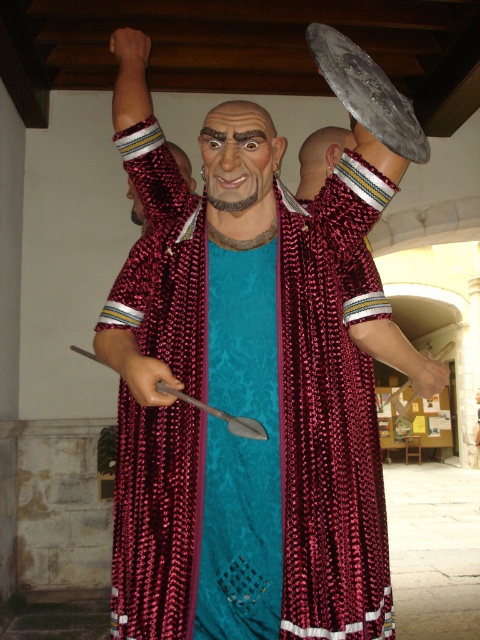
You are an artist trying to sketch the figure in the image. You want to place the shiny red cape at center accurately. According to the coordinates provided, where should you position it on your canvas?

The shiny red cape at center should be positioned at coordinates point [283,317] as specified.